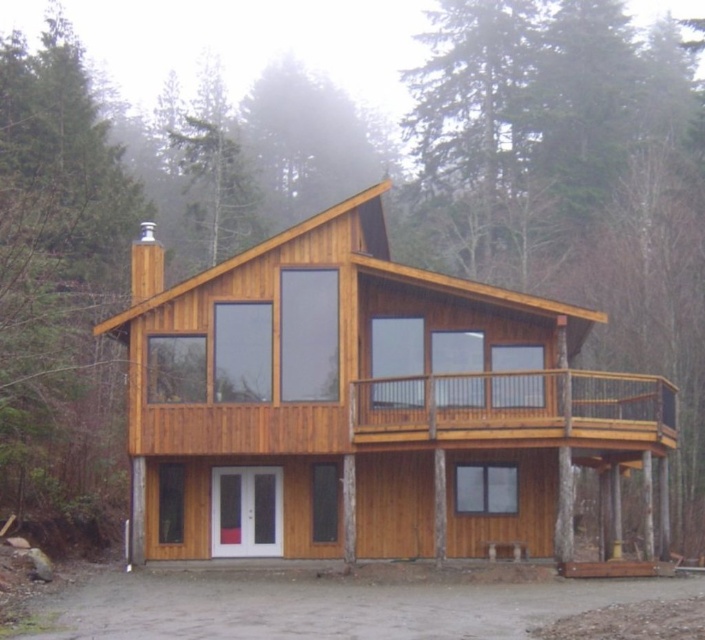
You are planning to host a small gathering at the natural wood log cabin at center and the wooden deck at center. Which location can accommodate more guests comfortably?

The natural wood log cabin at center is larger in size than the wooden deck at center, so it can accommodate more guests comfortably.

You are planning to park your car on the gray concrete driveway at lower center but also noticed the wooden deck at center. Which one has a bigger area for parking?

The gray concrete driveway at lower center is larger in size than the wooden deck at center, so it provides a bigger area for parking.

You are standing in front of the natural wood log cabin at center and want to place a large sculpture on the wooden deck at center. Considering their heights, can the sculpture be safely placed there without exceeding the deck height?

The natural wood log cabin at center is taller than wooden deck at center. Since the sculpture is large, it might exceed the deck height if it surpasses the cabin height. However, the deck height is lower than the cabin, so the sculpture should be placed only if its height is within the deck limits.